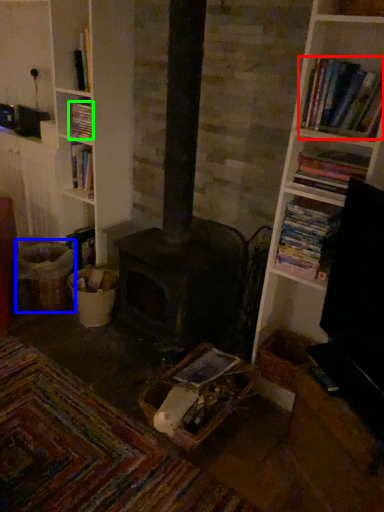
Question: Which object is positioned closest to book (highlighted by a red box)? Select from basket (highlighted by a blue box) and book (highlighted by a green box).

Choices:
 (A) basket
 (B) book

Answer: (B)